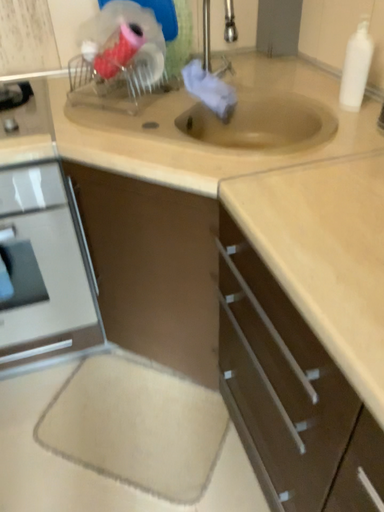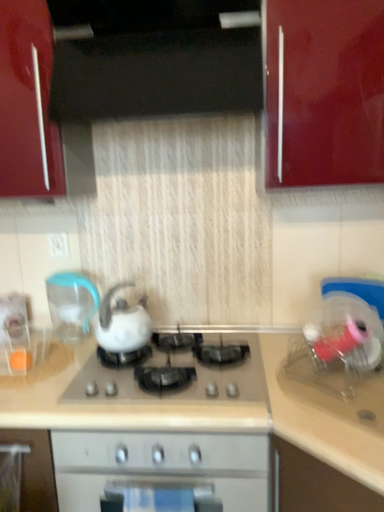
Question: How did the camera likely rotate when shooting the video?

Choices:
 (A) rotated right
 (B) rotated left

Answer: (B)